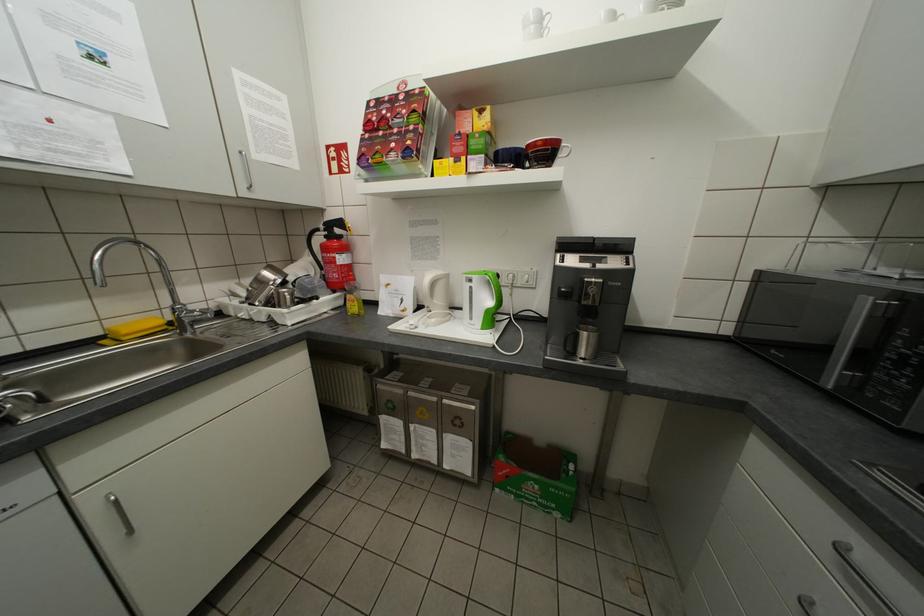
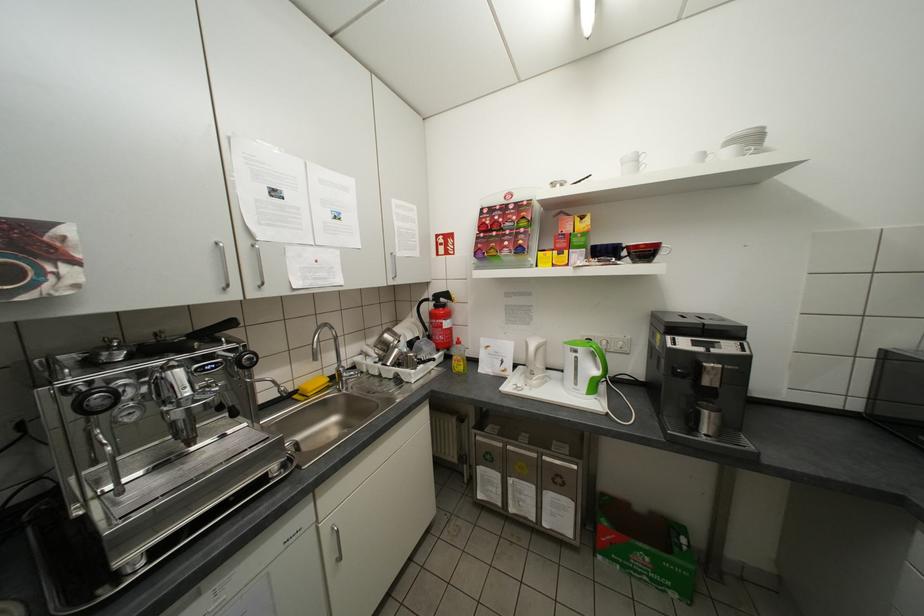
Where in the second image is the point corresponding to point (476, 281) from the first image?

(579, 351)